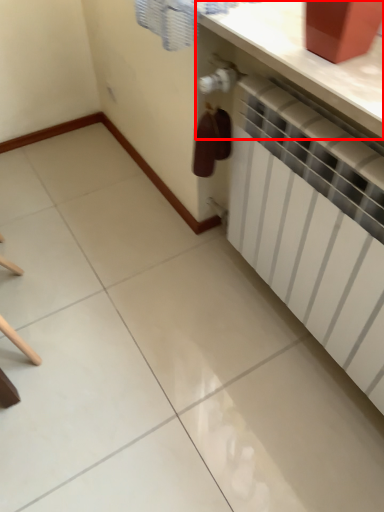
Question: Considering the relative positions of counter top (annotated by the red box) and radiator in the image provided, where is counter top (annotated by the red box) located with respect to the staircase?

Choices:
 (A) right
 (B) left

Answer: (B)